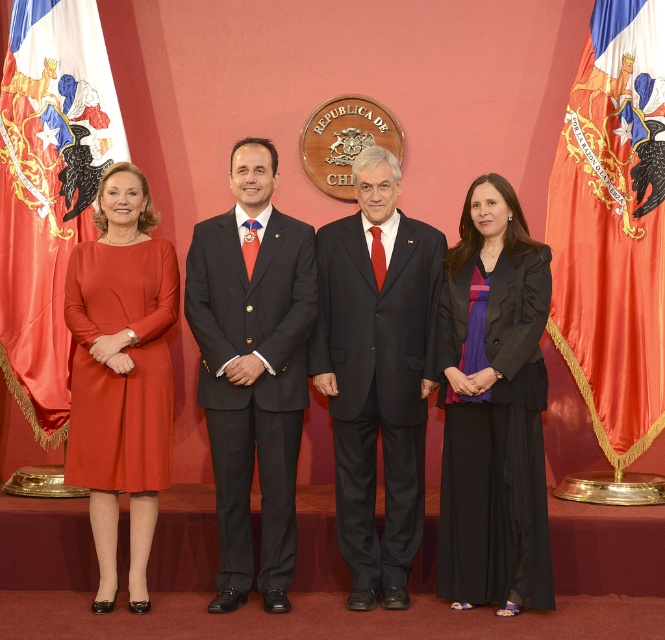
How far apart are matte black suit at center and matte orange dress at left?

A distance of 1.11 meters exists between matte black suit at center and matte orange dress at left.

In order to click on matte black suit at center in this screenshot , I will do `click(376, 372)`.

Is matte black suit at center thinner than silky red flag at left?

Yes, matte black suit at center is thinner than silky red flag at left.

Does matte black suit at center have a lesser height compared to silky red flag at left?

Yes.

Is point (414, 260) positioned behind point (86, 16)?

No, (414, 260) is in front of (86, 16).

In order to click on matte black suit at center in this screenshot , I will do `click(376, 372)`.

Is black satin suit at center below matte orange dress at left?

Incorrect, black satin suit at center is not positioned below matte orange dress at left.

Is point (235, 177) farther from camera compared to point (76, 349)?

No, it is not.

Where is `black satin suit at center`? The width and height of the screenshot is (665, 640). black satin suit at center is located at coordinates (251, 369).